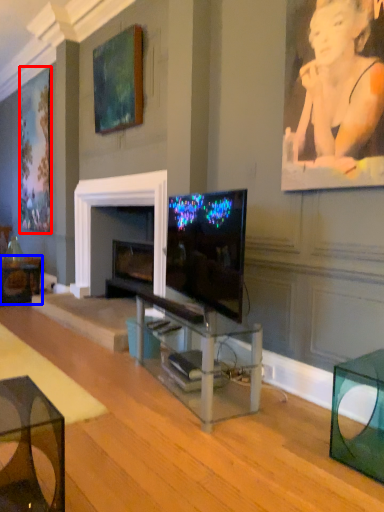
Question: Which object is closer to the camera taking this photo, picture frame (highlighted by a red box) or table (highlighted by a blue box)?

Choices:
 (A) picture frame
 (B) table

Answer: (B)